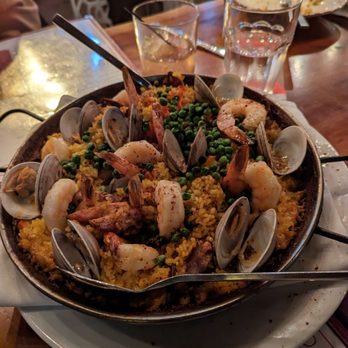
The height and width of the screenshot is (348, 348). Identify the location of table. (304, 87).